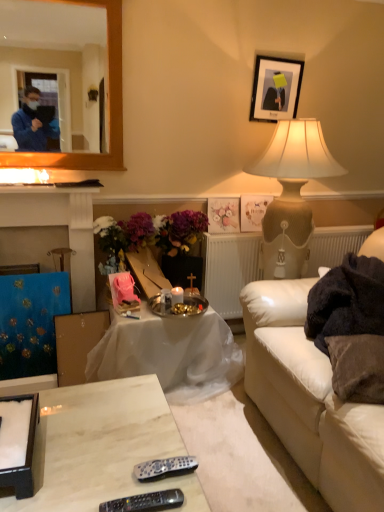
You are a GUI agent. You are given a task and a screenshot of the screen. Output one action in this format:
    pyautogui.click(x=<x>, y=<y>)
    Task: Click on the vacant area to the left of silver metallic remote at lower center, the 1th remote viewed from the back
    
    Given the screenshot: What is the action you would take?
    pyautogui.click(x=109, y=470)